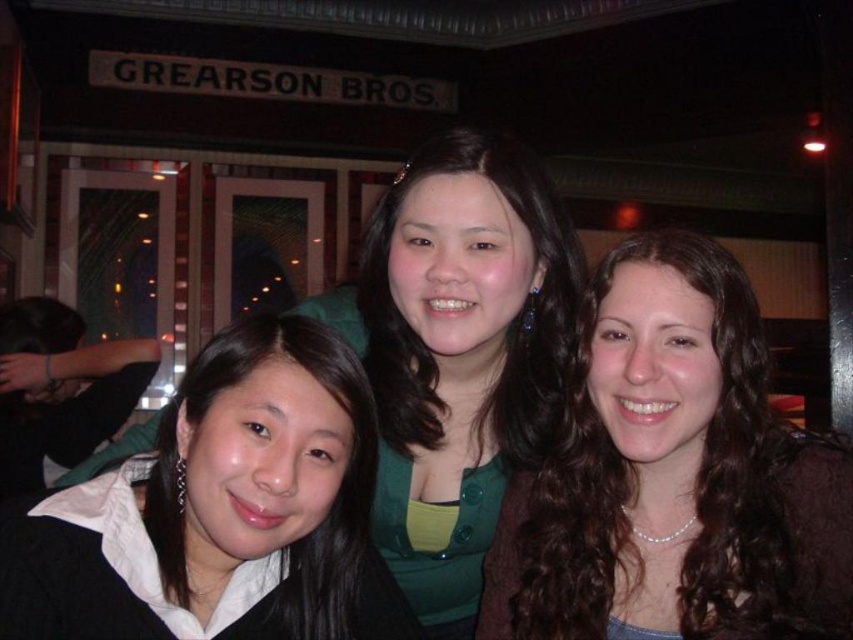
You are standing in the restaurant and want to move from the point at coordinates (129,488) to the point at (482,328). Since the person at the front is blocking your path, can you go around them?

Point (129,488) is in front of point (482,328), so the person at point (129,488) is blocking the path to point (482,328). You can go around them by moving to the side of the person at point (129,488) to reach your destination.